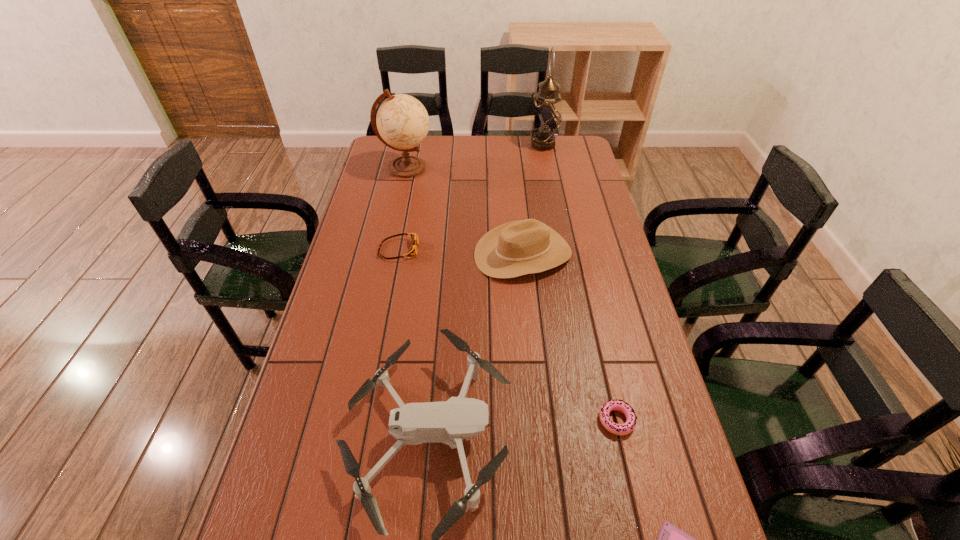
The height and width of the screenshot is (540, 960). I want to click on the farthest object, so click(x=546, y=118).

Locate an element on the screen. This screenshot has height=540, width=960. the tallest object is located at coordinates (546, 118).

The image size is (960, 540). Find the location of `globe`. globe is located at coordinates (402, 121).

I want to click on the second tallest object, so click(x=402, y=121).

The image size is (960, 540). What are the coordinates of `cowboy hat` in the screenshot? It's located at (521, 247).

Find the location of a particular element. The height and width of the screenshot is (540, 960). the third shortest object is located at coordinates (412, 251).

At what (x,y) coordinates should I click in order to perform the action: click on doughnut. Please return your answer as a coordinate pair (x, y). This screenshot has width=960, height=540. Looking at the image, I should click on (619, 405).

Where is `free space located on the surface of the sixth nearest object`? The height and width of the screenshot is (540, 960). free space located on the surface of the sixth nearest object is located at coordinates (529, 168).

At what (x,y) coordinates should I click in order to perform the action: click on free space located on the back of the cowboy hat. Please return your answer as a coordinate pair (x, y). Looking at the image, I should click on (518, 207).

This screenshot has height=540, width=960. In order to click on vacant space situated 0.350m with the lenses facing forward on the third shortest object in this screenshot , I will do `click(522, 249)`.